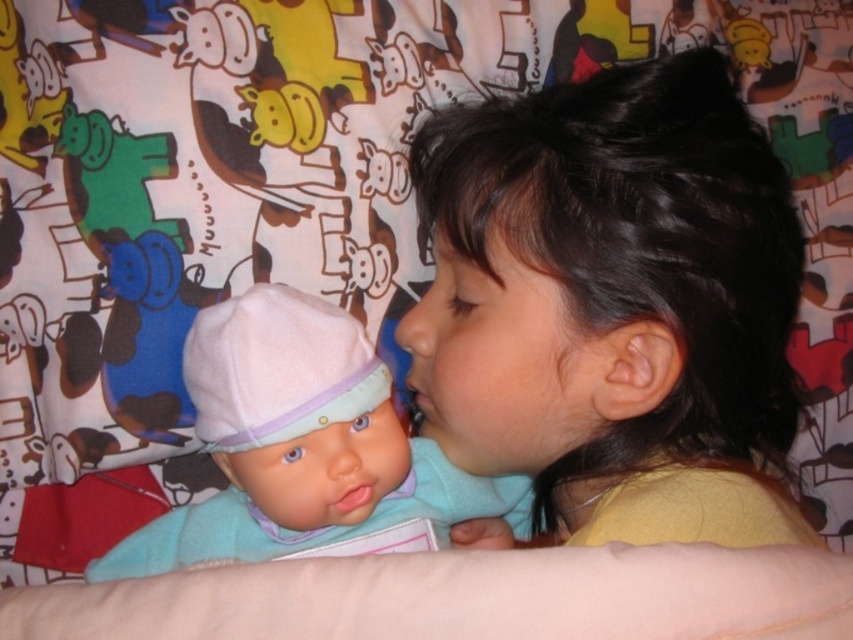
Can you confirm if smooth brown hair at upper right is positioned to the right of matte pink fabric doll at left?

Correct, you'll find smooth brown hair at upper right to the right of matte pink fabric doll at left.

Does point (693, 112) lie in front of point (334, 432)?

Yes, it is.

You are a GUI agent. You are given a task and a screenshot of the screen. Output one action in this format:
    pyautogui.click(x=<x>, y=<y>)
    Task: Click on the smooth brown hair at upper right
    
    Given the screenshot: What is the action you would take?
    point(614,304)

Identify the location of smooth brown hair at upper right. This screenshot has height=640, width=853. (614, 304).